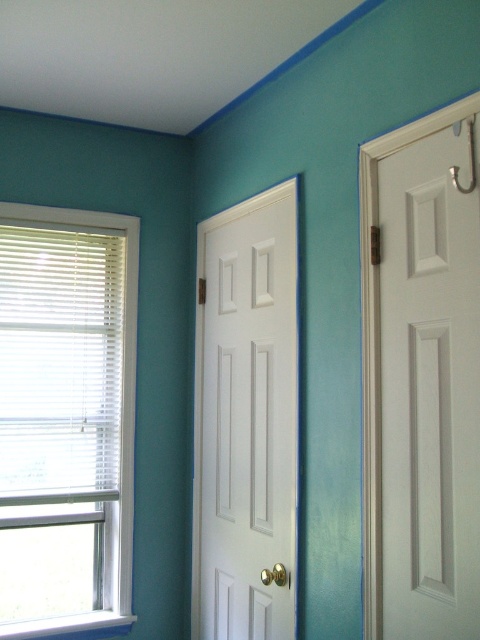
In the scene shown: You are a delivery person carrying a large package that is 80 centimeters wide. You need to move through the space between the white matte door at right and the white glossy door at center. Can you fit through the gap? Please explain your reasoning.

The gap between the white matte door at right and the white glossy door at center is 73.05 centimeters. Since the package is 80 centimeters wide, which is wider than the gap, you cannot fit through the space between them.

You are standing in the room and want to open the white plastic window at left. You are 1.7 meters tall. Can you reach the window sill if you stand on your toes?

The white plastic window at left is 2.55 meters away from you, so no, you cannot reach the window sill since it is too far away.

You are moving a large painting that is 1.2 meters wide. You want to hang it on the wall between the white plastic window at left and the white matte door at right. Can the space between them accommodate the painting?

The white plastic window at left is larger in size than white matte door at right, but the description does not provide the exact distance between them. Therefore, it is unclear if the space between them can accommodate a 1.2 meter wide painting.